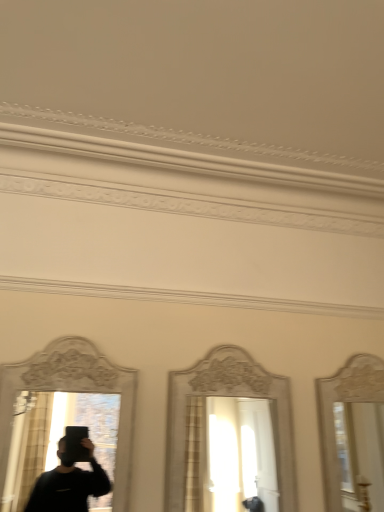
Question: Are white glossy mirror at center, the second mirror positioned from the left, and matte white mirror at left, which is counted as the 2th mirror, starting from the right, located far from each other?

Choices:
 (A) yes
 (B) no

Answer: (B)

Question: Considering the relative sizes of white glossy mirror at center, the second mirror positioned from the left, and matte white mirror at left, positioned as the 1th mirror in left-to-right order, in the image provided, is white glossy mirror at center, the second mirror positioned from the left, thinner than matte white mirror at left, positioned as the 1th mirror in left-to-right order,?

Choices:
 (A) yes
 (B) no

Answer: (B)

Question: Does white glossy mirror at center, the second mirror positioned from the left, appear on the right side of matte white mirror at left, which is counted as the 2th mirror, starting from the right?

Choices:
 (A) no
 (B) yes

Answer: (B)

Question: Considering the relative sizes of white glossy mirror at center, the second mirror positioned from the left, and matte white mirror at left, positioned as the 1th mirror in left-to-right order, in the image provided, is white glossy mirror at center, the second mirror positioned from the left, wider than matte white mirror at left, positioned as the 1th mirror in left-to-right order,?

Choices:
 (A) yes
 (B) no

Answer: (A)

Question: Does white glossy mirror at center, the second mirror positioned from the left, have a lesser height compared to matte white mirror at left, which is counted as the 2th mirror, starting from the right?

Choices:
 (A) no
 (B) yes

Answer: (A)

Question: Is white glossy mirror at center, marked as the 1th mirror in a right-to-left arrangement, bigger than matte white mirror at left, which is counted as the 2th mirror, starting from the right?

Choices:
 (A) no
 (B) yes

Answer: (B)

Question: Does matte white mirror at left, which is counted as the 2th mirror, starting from the right, have a greater width compared to white glossy mirror at center, the second mirror positioned from the left?

Choices:
 (A) no
 (B) yes

Answer: (A)

Question: From the image's perspective, is matte white mirror at left, positioned as the 1th mirror in left-to-right order, above white glossy mirror at center, marked as the 1th mirror in a right-to-left arrangement?

Choices:
 (A) no
 (B) yes

Answer: (B)

Question: Is the depth of matte white mirror at left, which is counted as the 2th mirror, starting from the right, less than that of white glossy mirror at center, marked as the 1th mirror in a right-to-left arrangement?

Choices:
 (A) no
 (B) yes

Answer: (B)

Question: From the image's perspective, would you say matte white mirror at left, positioned as the 1th mirror in left-to-right order, is shown under white glossy mirror at center, marked as the 1th mirror in a right-to-left arrangement?

Choices:
 (A) yes
 (B) no

Answer: (B)

Question: Is matte white mirror at left, positioned as the 1th mirror in left-to-right order, smaller than white glossy mirror at center, marked as the 1th mirror in a right-to-left arrangement?

Choices:
 (A) yes
 (B) no

Answer: (A)

Question: Is matte white mirror at left, which is counted as the 2th mirror, starting from the right, beside white glossy mirror at center, marked as the 1th mirror in a right-to-left arrangement?

Choices:
 (A) yes
 (B) no

Answer: (B)

Question: From the image's perspective, is white glossy mirror at center, marked as the 1th mirror in a right-to-left arrangement, above or below matte white mirror at left, positioned as the 1th mirror in left-to-right order?

Choices:
 (A) below
 (B) above

Answer: (A)